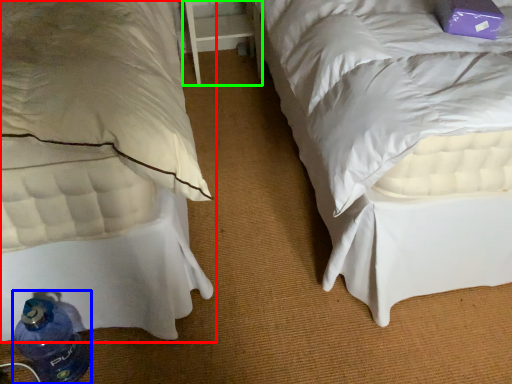
Question: Which object is the closest to the bed (highlighted by a red box)? Choose among these: bottle (highlighted by a blue box) or table (highlighted by a green box).

Choices:
 (A) bottle
 (B) table

Answer: (A)